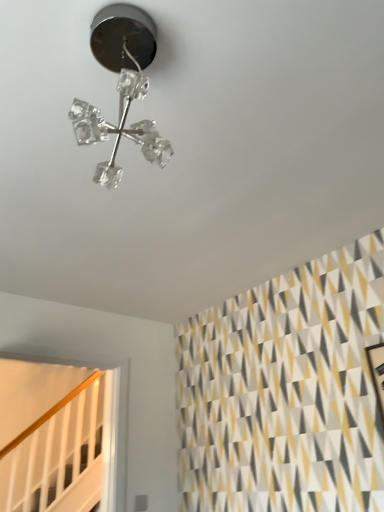
Question: Is clear crystal chandelier at upper center inside the boundaries of white wooden stairwell at lower left, or outside?

Choices:
 (A) outside
 (B) inside

Answer: (A)

Question: In terms of width, does clear crystal chandelier at upper center look wider or thinner when compared to white wooden stairwell at lower left?

Choices:
 (A) wide
 (B) thin

Answer: (A)

Question: Is point (129, 84) closer or farther from the camera than point (54, 444)?

Choices:
 (A) farther
 (B) closer

Answer: (B)

Question: Looking at their shapes, would you say white wooden stairwell at lower left is wider or thinner than clear crystal chandelier at upper center?

Choices:
 (A) thin
 (B) wide

Answer: (A)

Question: Considering the positions of white wooden stairwell at lower left and clear crystal chandelier at upper center in the image, is white wooden stairwell at lower left taller or shorter than clear crystal chandelier at upper center?

Choices:
 (A) tall
 (B) short

Answer: (A)

Question: Relative to clear crystal chandelier at upper center, is white wooden stairwell at lower left in front or behind?

Choices:
 (A) front
 (B) behind

Answer: (B)

Question: Considering the relative positions of white wooden stairwell at lower left and clear crystal chandelier at upper center in the image provided, is white wooden stairwell at lower left to the left or to the right of clear crystal chandelier at upper center?

Choices:
 (A) right
 (B) left

Answer: (B)